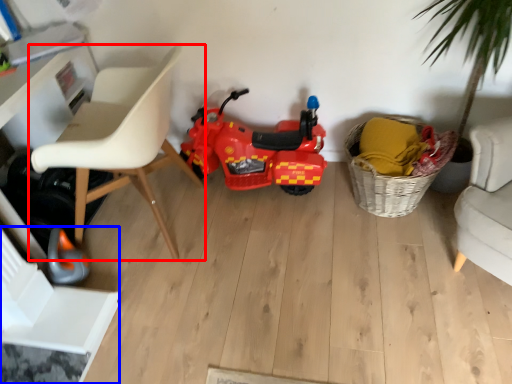
Question: Which of the following is the farthest to the observer, chair (highlighted by a red box) or swivel chair (highlighted by a blue box)?

Choices:
 (A) chair
 (B) swivel chair

Answer: (B)